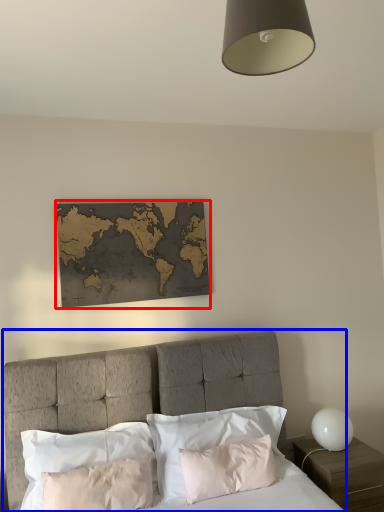
Question: Which object is closer to the camera taking this photo, picture frame (highlighted by a red box) or bed (highlighted by a blue box)?

Choices:
 (A) picture frame
 (B) bed

Answer: (B)